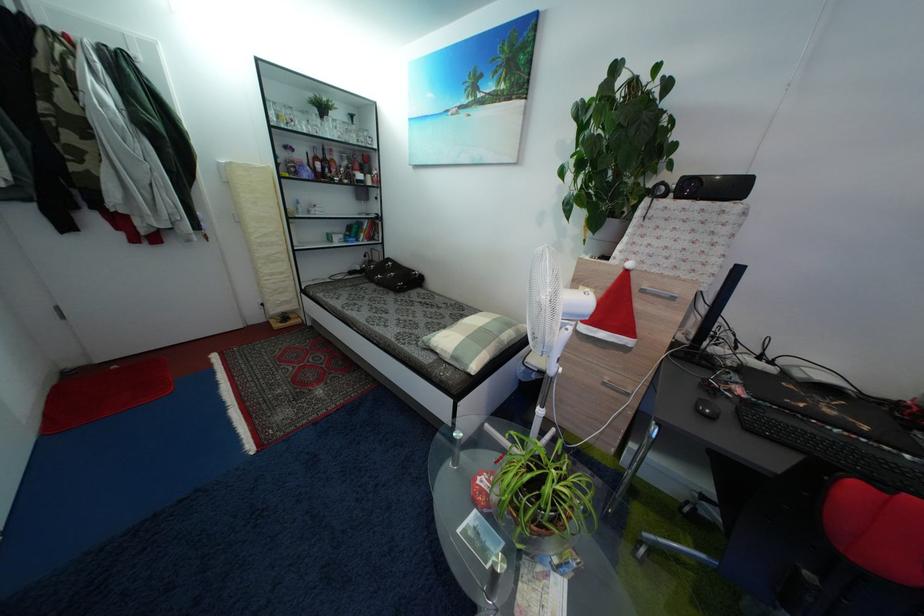
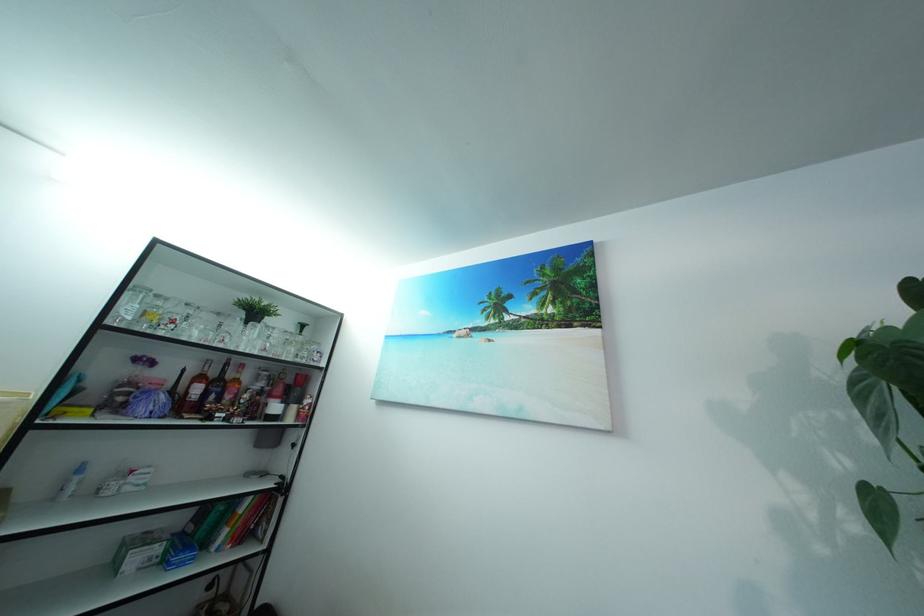
In the second image, find the point that corresponds to (x=334, y=169) in the first image.

(226, 391)